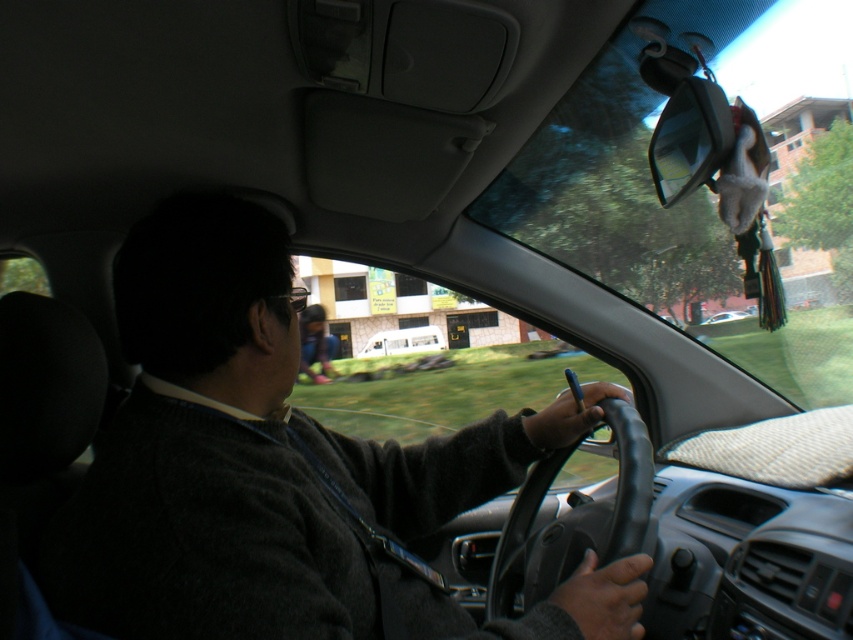
You are a passenger in the car and want to hand the driver a document. The driver is wearing a dark gray sweater at center and holding a black leather steering wheel at center. Which object should you reach towards to place the document so it doesn not fall?

The dark gray sweater at center is positioned on the left side of black leather steering wheel at center. You should place the document on the dark gray sweater at center since it is closer to your side as a passenger.

You are sitting in the passenger seat of the car. You see the matte black shirt at center and the white matte van at center. Which object is closer to you?

The matte black shirt at center is closer to the viewer than the white matte van at center.

You are sitting in the passenger seat of the car and looking out the windshield. There are two points marked on the windshield at coordinates point (317, 308) and point (392, 339). Which point is closer to you?

Point (317, 308) is in front of point (392, 339), so the point closer to you is point (392, 339).